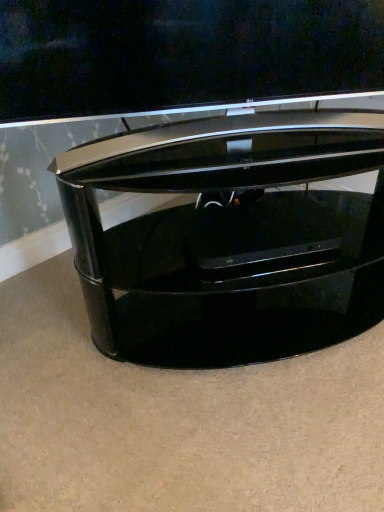
The width and height of the screenshot is (384, 512). What are the coordinates of `glossy black tv stand at center` in the screenshot? It's located at coord(230,238).

The image size is (384, 512). What do you see at coordinates (230, 238) in the screenshot?
I see `glossy black tv stand at center` at bounding box center [230, 238].

Measure the distance between glossy black tv stand at center and camera.

glossy black tv stand at center and camera are 28.77 inches apart.

Image resolution: width=384 pixels, height=512 pixels. Identify the location of glossy black tv stand at center. (230, 238).